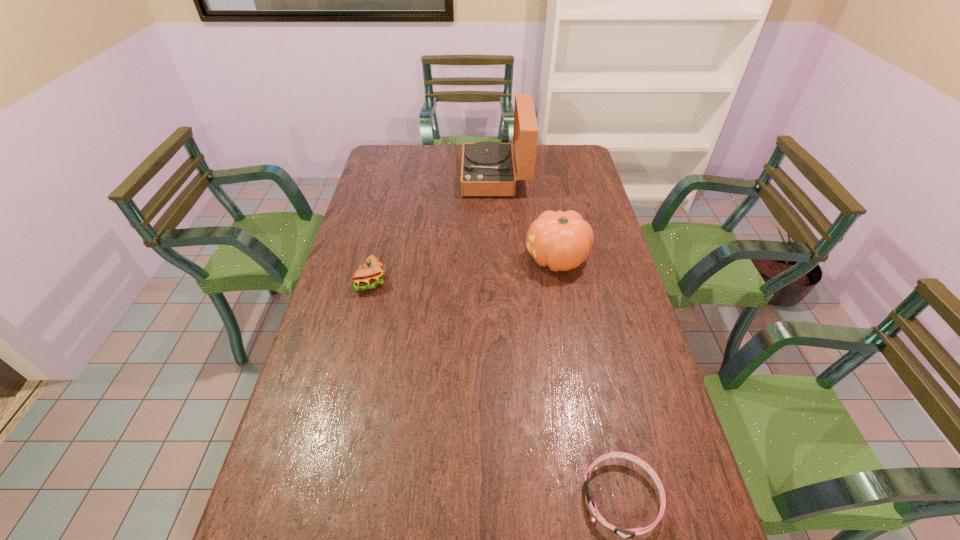
Where is `vacant space located 0.060m on the carved face of the pumpkin`? Image resolution: width=960 pixels, height=540 pixels. vacant space located 0.060m on the carved face of the pumpkin is located at coordinates (507, 259).

In order to click on vacant region located on the right of the sandwich in this screenshot , I will do `click(493, 282)`.

Find the location of a particular element. object that is at the far edge is located at coordinates (487, 168).

Where is `object located at the left edge`? object located at the left edge is located at coordinates (370, 275).

Where is `object located at the right edge`? The height and width of the screenshot is (540, 960). object located at the right edge is located at coordinates (560, 240).

Locate an element on the screen. This screenshot has width=960, height=540. vacant space at the far edge of the desktop is located at coordinates (434, 164).

This screenshot has height=540, width=960. In the image, there is a desktop. What are the coordinates of `blank space at the left edge` in the screenshot? It's located at (302, 456).

In the image, there is a desktop. What are the coordinates of `vacant area at the right edge` in the screenshot? It's located at (593, 303).

This screenshot has width=960, height=540. Find the location of `vacant space at the far left corner of the desktop`. vacant space at the far left corner of the desktop is located at coordinates (385, 150).

You are a GUI agent. You are given a task and a screenshot of the screen. Output one action in this format:
    pyautogui.click(x=<x>, y=<y>)
    Task: Click on the blank space at the far right corner
    The width and height of the screenshot is (960, 540).
    Given the screenshot: What is the action you would take?
    pyautogui.click(x=567, y=154)